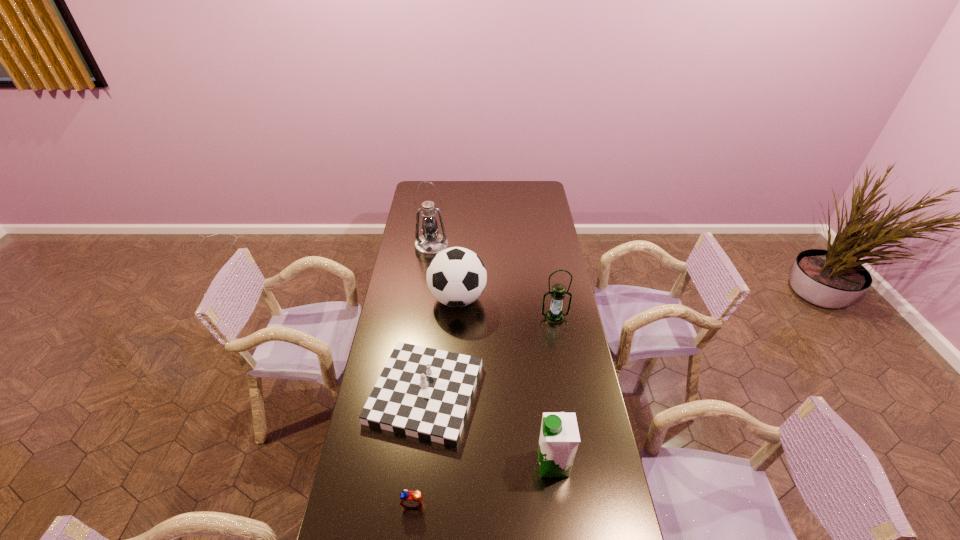
Locate an element on the screen. The height and width of the screenshot is (540, 960). free space that satisfies the following two spatial constraints: 1. on the side where the lantern emits light; 2. on the front-facing side of the second nearest object is located at coordinates (580, 464).